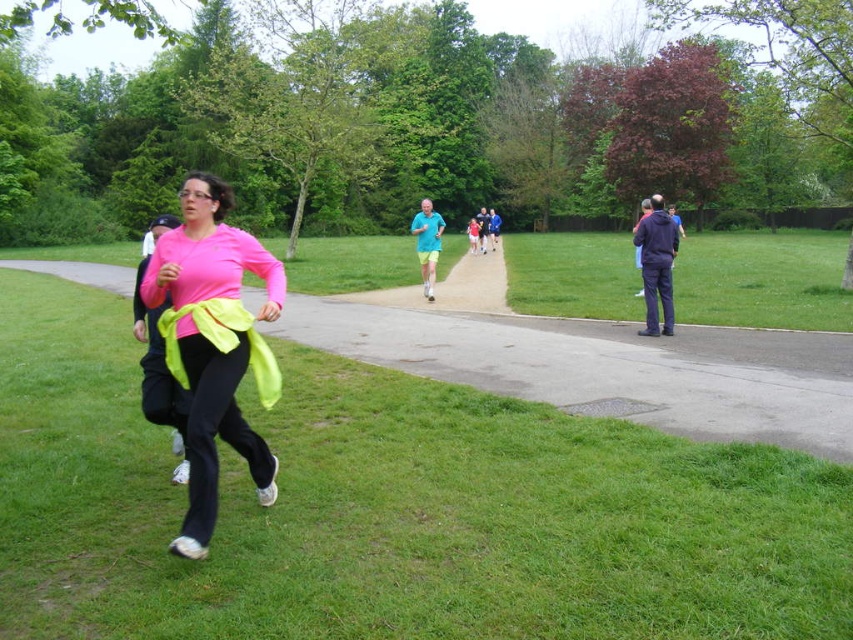
Identify the location of dark blue jacket at right. (656, 266).

Can you confirm if dark blue jacket at right is smaller than blue fabric shirt at center?

Yes.

Looking at this image, measure the distance between point (677, 230) and camera.

Point (677, 230) and camera are 12.19 meters apart.

You are a GUI agent. You are given a task and a screenshot of the screen. Output one action in this format:
    pyautogui.click(x=<x>, y=<y>)
    Task: Click on the dark blue jacket at right
    
    Given the screenshot: What is the action you would take?
    pyautogui.click(x=656, y=266)

Can you confirm if green grass at lower left is positioned below matte blue shirt at center?

Yes.

Is green grass at lower left smaller than matte blue shirt at center?

Yes, green grass at lower left is smaller than matte blue shirt at center.

Does point (733, 627) come farther from viewer compared to point (416, 252)?

No.

Locate an element on the screen. This screenshot has height=640, width=853. green grass at lower left is located at coordinates (390, 509).

Between pink matte shirt at center and dark blue jacket at right, which one is positioned higher?

dark blue jacket at right

The image size is (853, 640). Describe the element at coordinates (213, 344) in the screenshot. I see `pink matte shirt at center` at that location.

This screenshot has height=640, width=853. What are the coordinates of `pink matte shirt at center` in the screenshot? It's located at (213, 344).

At what (x,y) coordinates should I click in order to perform the action: click on pink matte shirt at center. Please return your answer as a coordinate pair (x, y). This screenshot has height=640, width=853. Looking at the image, I should click on (213, 344).